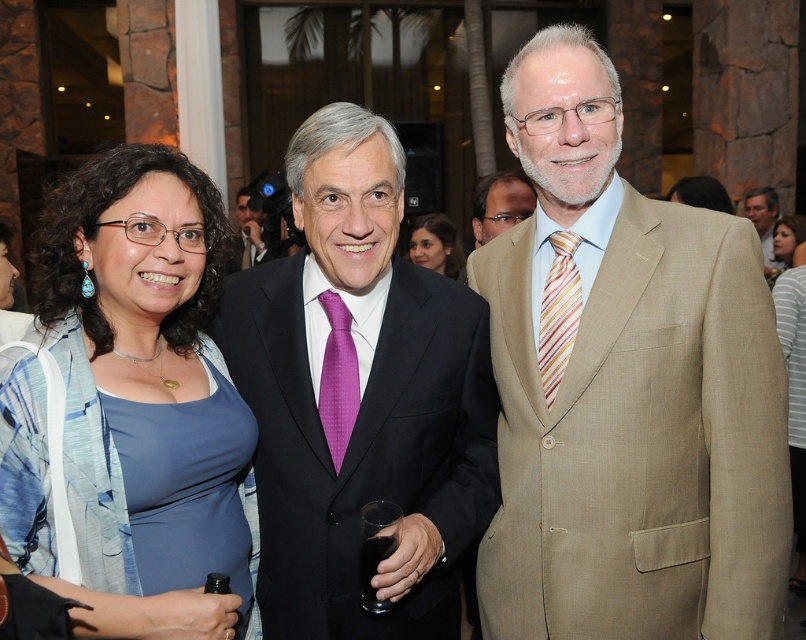
Is blue fabric dress at center wider than matte black dress at center?

Yes, blue fabric dress at center is wider than matte black dress at center.

Is point (206, 506) farther from viewer compared to point (422, 216)?

No, (206, 506) is in front of (422, 216).

In order to click on blue fabric dress at center in this screenshot , I will do `click(134, 403)`.

Who is higher up, purple textured tie at center or purple satin tie at center?

purple satin tie at center is above.

Looking at this image, is purple textured tie at center to the left of purple satin tie at center from the viewer's perspective?

In fact, purple textured tie at center is to the right of purple satin tie at center.

Find the location of `purple textured tie at center`. purple textured tie at center is located at coordinates (337, 378).

Identify the location of purple textured tie at center. (337, 378).

Looking at this image, is striped silk tie at center positioned at the back of matte black dress at center?

No.

Can you confirm if striped silk tie at center is positioned to the right of matte black dress at center?

Indeed, striped silk tie at center is positioned on the right side of matte black dress at center.

Describe the element at coordinates (559, 312) in the screenshot. I see `striped silk tie at center` at that location.

Where is `striped silk tie at center`? striped silk tie at center is located at coordinates (559, 312).